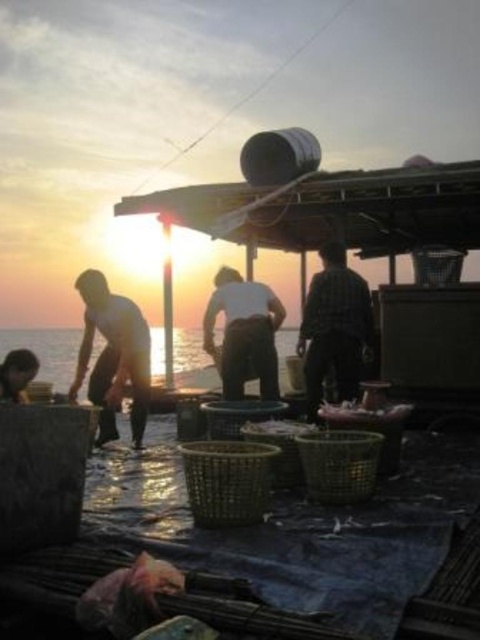
You are a photographer trying to capture the sunset scene. You notice the silhouette fabric fisherman at center and the shiny silver fish at lower center. Which object is located to the right of the other?

The shiny silver fish at lower center is located to the right of the silhouette fabric fisherman at center.